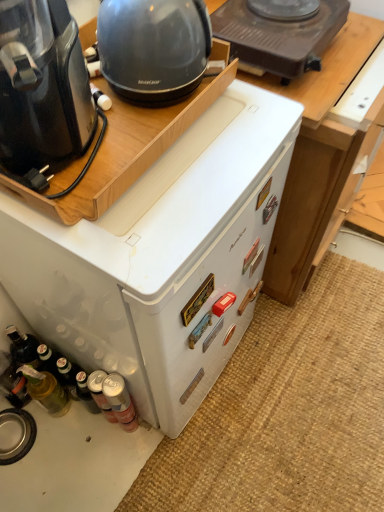
Image resolution: width=384 pixels, height=512 pixels. I want to click on vacant space that is to the left of metallic silver can at lower left, the 3th bottle viewed from the left, so click(72, 443).